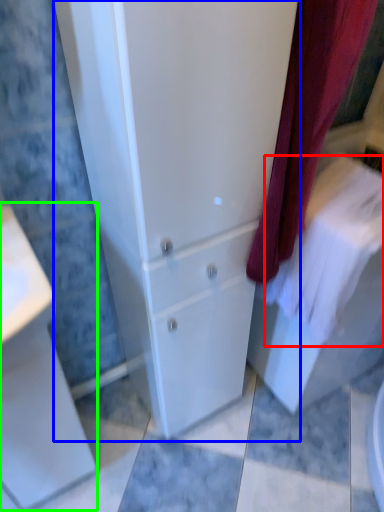
Question: Which is farther away from bath towel (highlighted by a red box)? bathroom cabinet (highlighted by a blue box) or porcelain (highlighted by a green box)?

Choices:
 (A) bathroom cabinet
 (B) porcelain

Answer: (B)